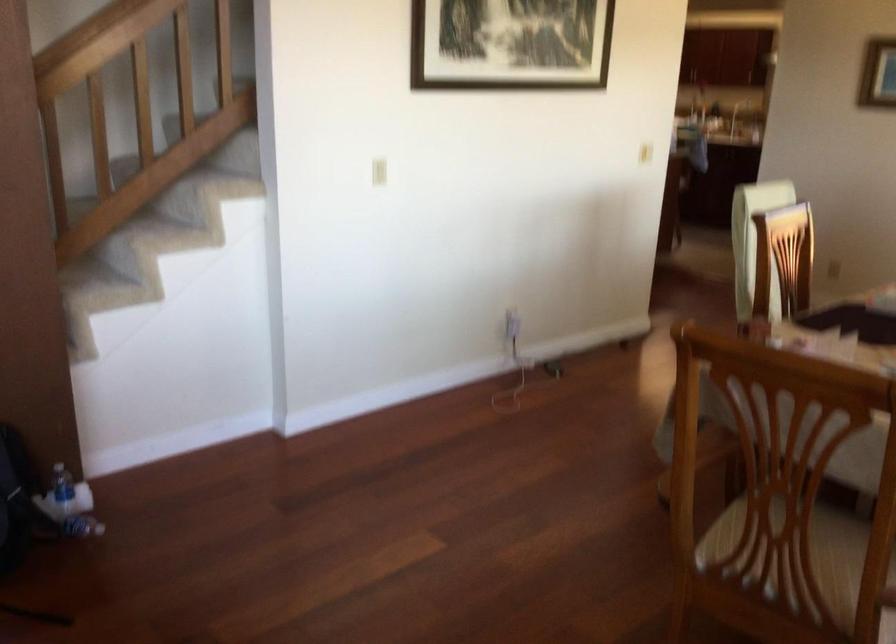
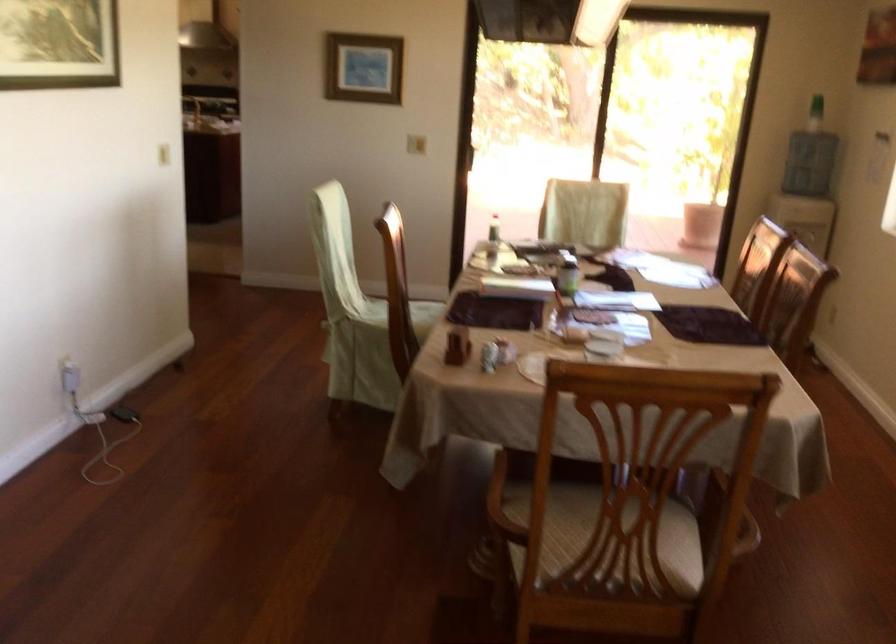
In the second image, find the point that corresponds to (x=737, y=493) in the first image.

(503, 504)